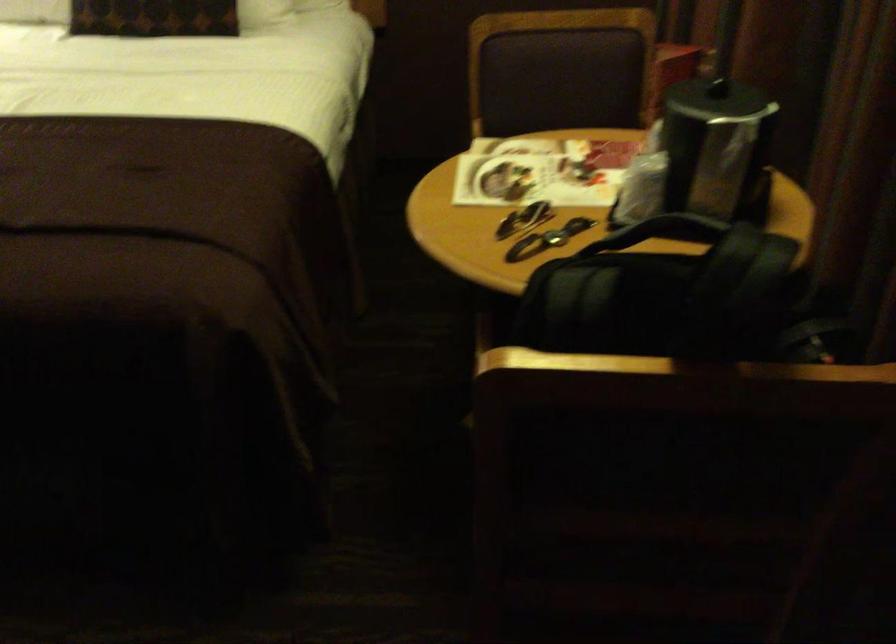
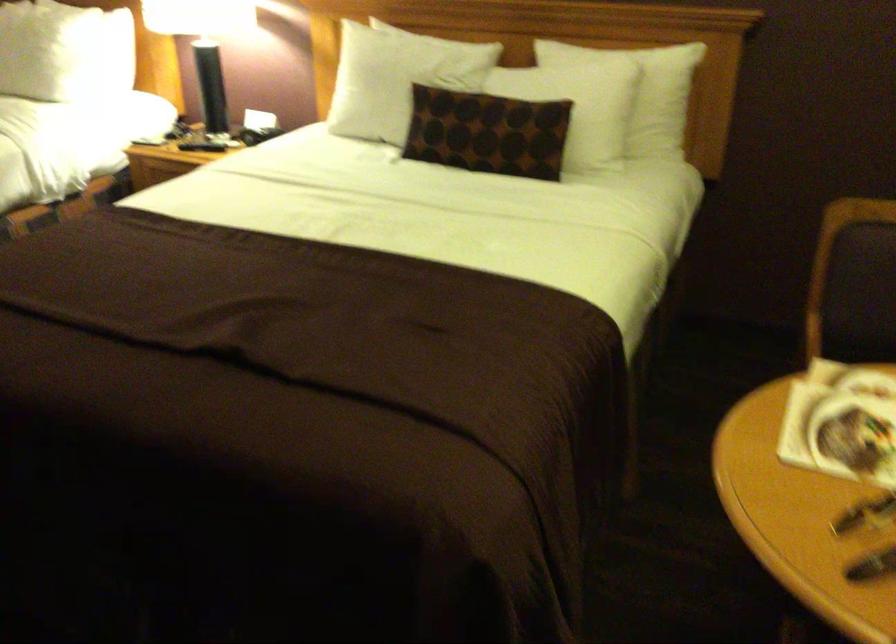
Question: The camera is either moving clockwise (left) or counter-clockwise (right) around the object. The first image is from the beginning of the video and the second image is from the end. Is the camera moving left or right when shooting the video?

Choices:
 (A) Left
 (B) Right

Answer: (B)